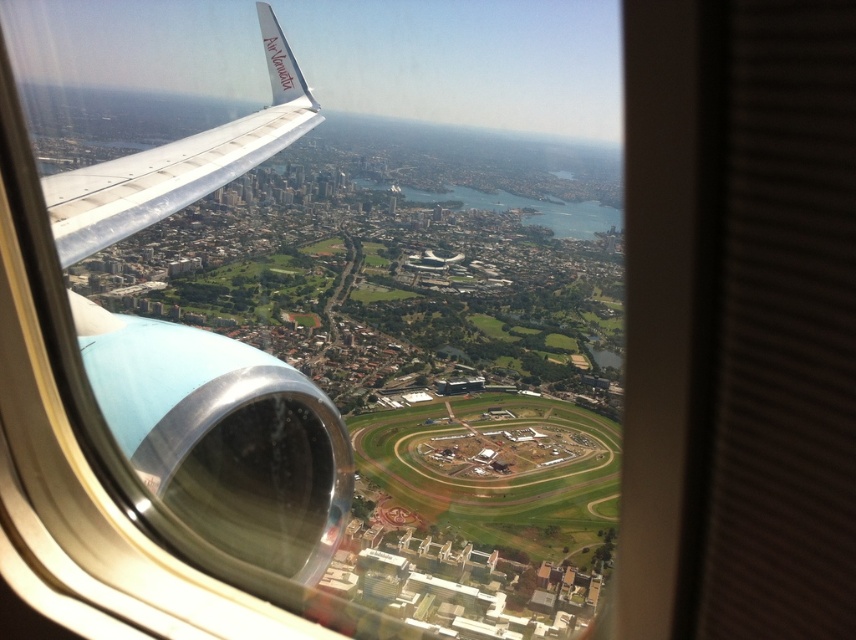
What is the 2D coordinate of the metallic silver wing at left in the image?

The metallic silver wing at left is located at the 2D coordinate point of (223,436).

You are a passenger sitting in the airplane and looking out the window. You notice a point marked at coordinates (223, 436). What object is located at that point?

The point at coordinates (223, 436) marks the metallic silver wing at left.

You are a passenger sitting by the window and notice two wings outside your window. The metallic silver wing at left and the white matte wing at upper left. Which wing is closer to you?

The metallic silver wing at left is closer to you because the white matte wing at upper left is behind it.